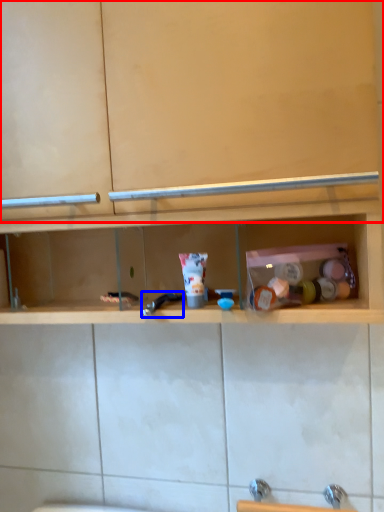
Question: Among these objects, which one is nearest to the camera, cabinet (highlighted by a red box) or faucet (highlighted by a blue box)?

Choices:
 (A) cabinet
 (B) faucet

Answer: (A)